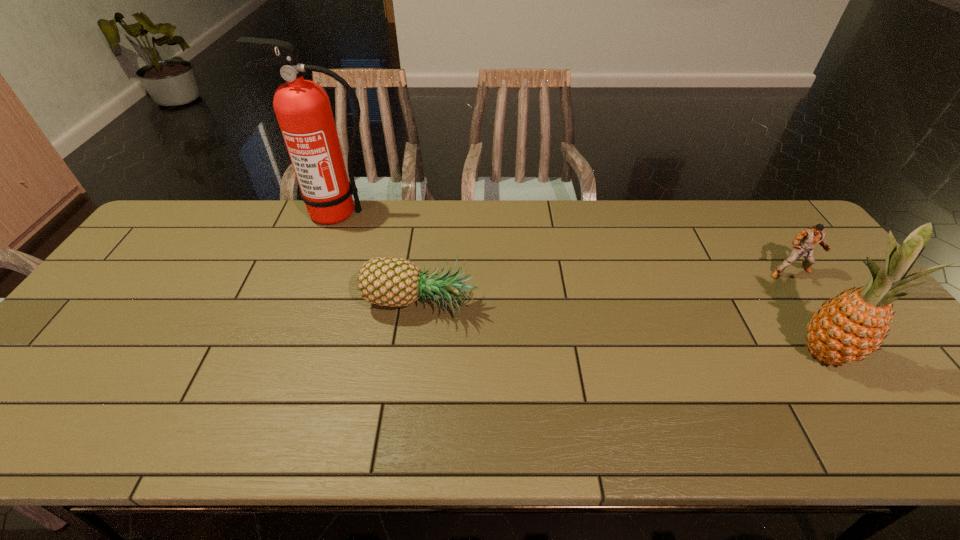
What are the coordinates of `free space located on the right of the second object from left to right` in the screenshot? It's located at (554, 307).

Find the location of a particular element. The width and height of the screenshot is (960, 540). object that is at the far edge is located at coordinates (303, 110).

Identify the location of pineapple located at the right edge. The height and width of the screenshot is (540, 960). (848, 328).

Locate an element on the screen. puncher present at the right edge is located at coordinates (809, 238).

Where is `vacant space at the far edge of the desktop`? vacant space at the far edge of the desktop is located at coordinates (396, 223).

I want to click on free space at the near edge, so click(x=460, y=423).

Find the location of `vacant space at the left edge`. vacant space at the left edge is located at coordinates (122, 296).

What are the coordinates of `vacant point at the far left corner` in the screenshot? It's located at (157, 233).

The height and width of the screenshot is (540, 960). Identify the location of vacant space at the near right corner. (914, 424).

You are a GUI agent. You are given a task and a screenshot of the screen. Output one action in this format:
    pyautogui.click(x=<x>, y=<y>)
    Task: Click on the vacant space that's between the left pineapple and the third nearest object
    
    Given the screenshot: What is the action you would take?
    pyautogui.click(x=606, y=289)